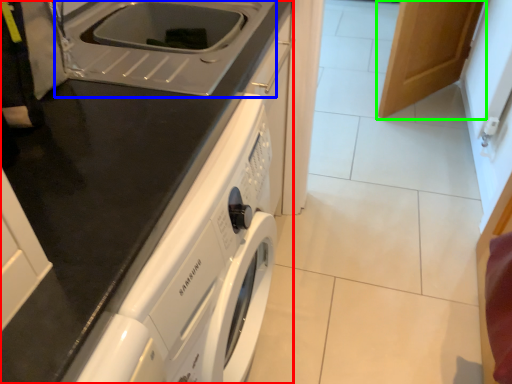
Question: Which is nearer to the home appliance (highlighted by a red box)? sink (highlighted by a blue box) or cabinetry (highlighted by a green box).

Choices:
 (A) sink
 (B) cabinetry

Answer: (A)